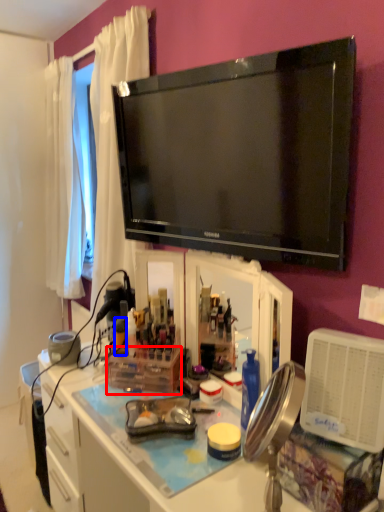
Question: Which object appears closest to the camera in this image, box (highlighted by a red box) or bottle (highlighted by a blue box)?

Choices:
 (A) box
 (B) bottle

Answer: (A)